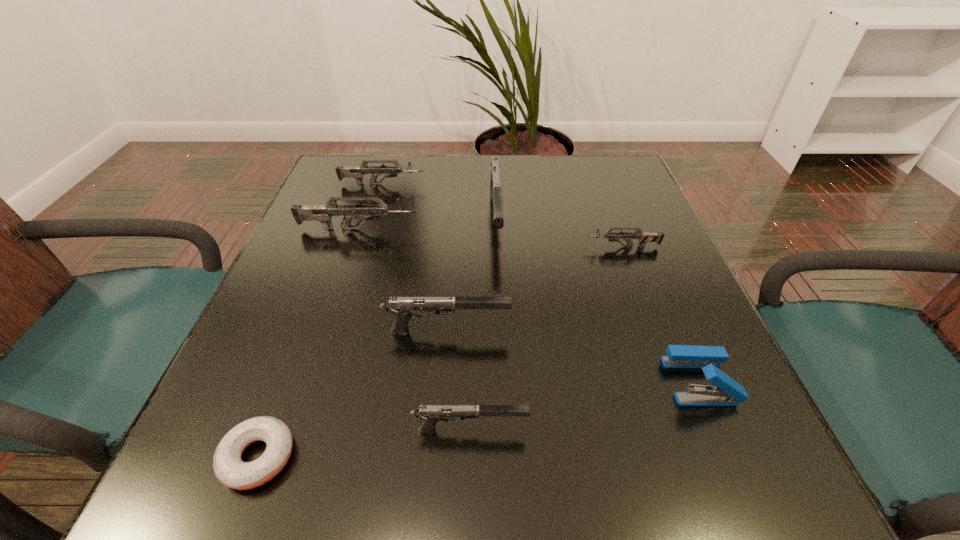
Locate an element on the screen. This screenshot has height=540, width=960. gray gun that is the closest to the nearest gun is located at coordinates (402, 307).

You are a GUI agent. You are given a task and a screenshot of the screen. Output one action in this format:
    pyautogui.click(x=<x>, y=<y>)
    Task: Click on the second closest grey gun relative to the doughnut
    The image size is (960, 540).
    Given the screenshot: What is the action you would take?
    pyautogui.click(x=644, y=237)

Select which grey gun appears as the third closest to the shortest object. Please provide its 2D coordinates. Your answer should be formatted as a tuple, i.e. [(x, y)], where the tuple contains the x and y coordinates of a point satisfying the conditions above.

[(357, 172)]

You are a GUI agent. You are given a task and a screenshot of the screen. Output one action in this format:
    pyautogui.click(x=<x>, y=<y>)
    Task: Click on the free space in the image that satisfies the following two spatial constraints: 1. on the back side of the stapler; 2. aimed along the barrel of the farthest grey gun
    This screenshot has height=540, width=960.
    Given the screenshot: What is the action you would take?
    [616, 184]

The image size is (960, 540). What are the coordinates of `vacant region that satisfies the following two spatial constraints: 1. at the muzzle end of the fifth farthest object; 2. on the back side of the third nearest object` in the screenshot? It's located at (444, 381).

The width and height of the screenshot is (960, 540). What are the coordinates of `vacant space that satisfies the following two spatial constraints: 1. at the muzzle end of the stapler; 2. on the left side of the second smallest gray gun` in the screenshot? It's located at (444, 381).